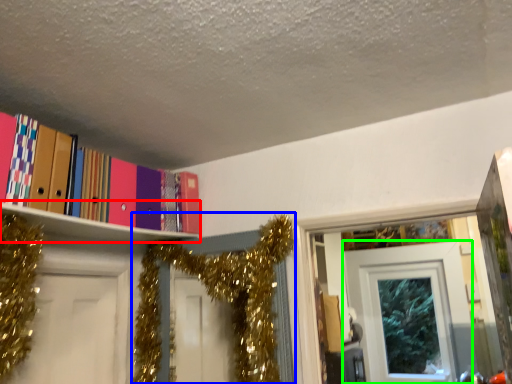
Question: Considering the real-world distances, which object is closest to shelf (highlighted by a red box)? christmas decoration (highlighted by a blue box) or door (highlighted by a green box).

Choices:
 (A) christmas decoration
 (B) door

Answer: (A)